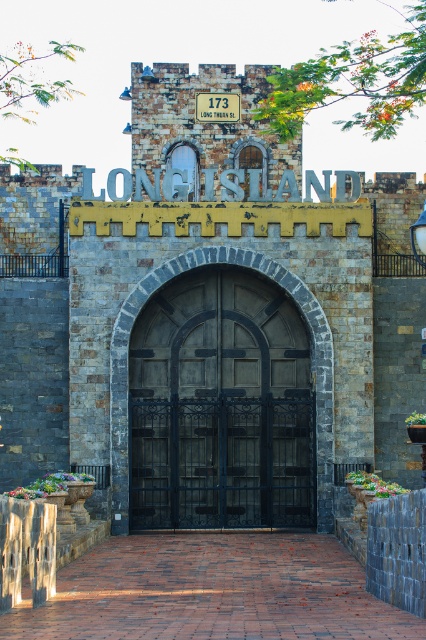
Can you confirm if dark wood gate at center is positioned above white brick sign at center?

No.

Does point (215, 314) come farther from viewer compared to point (219, 118)?

No, it is not.

Locate an element on the screen. dark wood gate at center is located at coordinates (221, 406).